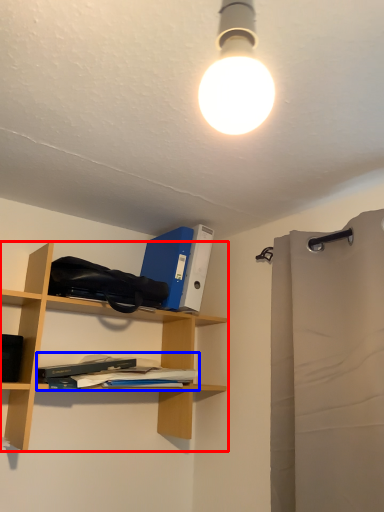
Question: Which point is further to the camera, shelf (highlighted by a red box) or book (highlighted by a blue box)?

Choices:
 (A) shelf
 (B) book

Answer: (B)